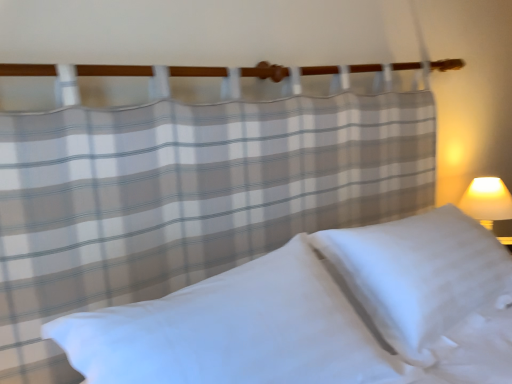
Question: In terms of height, does white smooth pillow at center, the first pillow from the left, look taller or shorter compared to white soft pillow at lower right, which is the 1th pillow from right to left?

Choices:
 (A) short
 (B) tall

Answer: (A)

Question: Is white smooth pillow at center, arranged as the second pillow when viewed from the right, situated inside white soft pillow at lower right, which is the 1th pillow from right to left, or outside?

Choices:
 (A) outside
 (B) inside

Answer: (A)

Question: Based on their positions, is white smooth pillow at center, arranged as the second pillow when viewed from the right, located to the left or right of white soft pillow at lower right, marked as the 2th pillow in a left-to-right arrangement?

Choices:
 (A) right
 (B) left

Answer: (B)

Question: Looking at the image, does white soft pillow at lower right, which is the 1th pillow from right to left, seem bigger or smaller compared to white smooth pillow at center, arranged as the second pillow when viewed from the right?

Choices:
 (A) small
 (B) big

Answer: (B)

Question: Is white soft pillow at lower right, which is the 1th pillow from right to left, situated inside white smooth pillow at center, arranged as the second pillow when viewed from the right, or outside?

Choices:
 (A) outside
 (B) inside

Answer: (A)

Question: Visually, is white soft pillow at lower right, marked as the 2th pillow in a left-to-right arrangement, positioned to the left or to the right of white smooth pillow at center, arranged as the second pillow when viewed from the right?

Choices:
 (A) right
 (B) left

Answer: (A)

Question: Is white soft pillow at lower right, which is the 1th pillow from right to left, wider or thinner than white smooth pillow at center, arranged as the second pillow when viewed from the right?

Choices:
 (A) thin
 (B) wide

Answer: (A)